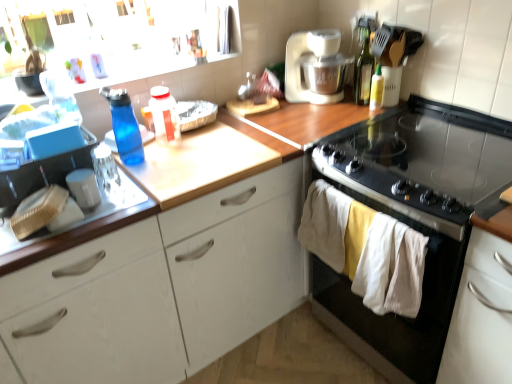
Find the location of a particular element. vacant area in front of translucent plastic bottle at center, the 2th bottle positioned from the left is located at coordinates (170, 160).